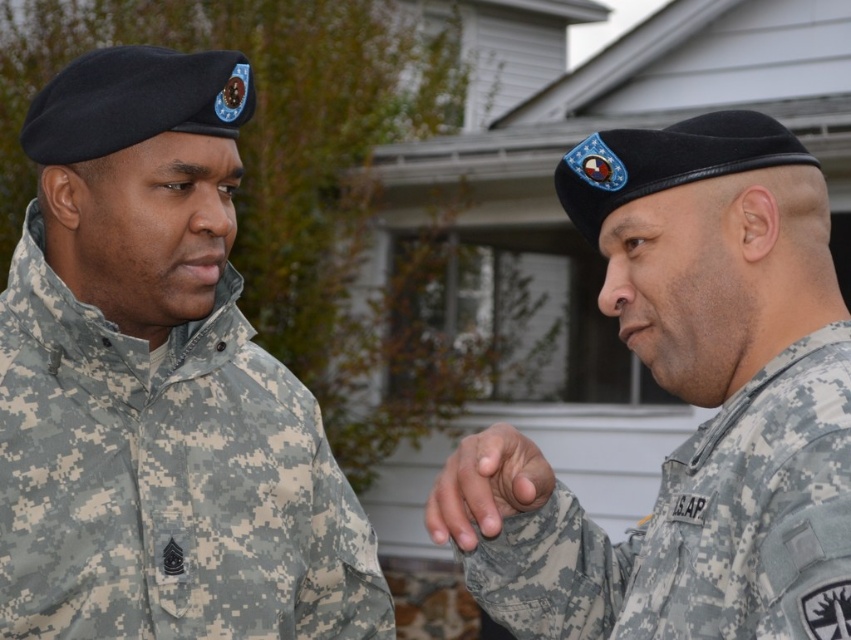
You are a military photographer aiming to capture a closeup shot of the camouflage fabric beret at center and camouflage fabric hand at center. Given that your camera can only focus on objects within a 6 inch range, will you be able to capture both items in focus?

The distance between the camouflage fabric beret at center and camouflage fabric hand at center is 8.09 inches, which exceeds the camera focus range of 6 inches. Therefore, you cannot capture both items in focus simultaneously.

In the scene shown: You are an observer standing in front of the house. You notice two objects in the scene described as the camouflage fabric uniform at left and the camouflage fabric hand at center. Which object appears bigger in size?

The camouflage fabric uniform at left appears bigger in size compared to the camouflage fabric hand at center, as stated in the description.

You are a military analyst observing two soldiers in a field report. You notice the camouflage fabric uniform at left and the camouflage fabric hand at center. Which object is positioned higher in the image?

The camouflage fabric uniform at left is taller than the camouflage fabric hand at center, so the camouflage fabric uniform at left is positioned higher in the image.